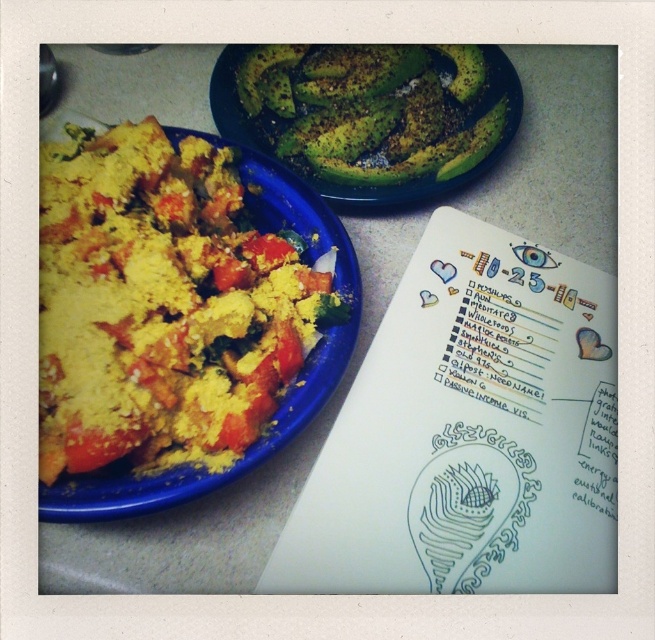
Question: Among these objects, which one is farthest from the camera?

Choices:
 (A) yellow crumbly at left
 (B) green matte avocado at upper center

Answer: (B)

Question: Among these objects, which one is farthest from the camera?

Choices:
 (A) green matte avocado at upper center
 (B) yellow crumbly at left

Answer: (A)

Question: Is yellow crumbly at left below green matte avocado at upper center?

Choices:
 (A) no
 (B) yes

Answer: (B)

Question: Does yellow crumbly at left appear on the right side of green matte avocado at upper center?

Choices:
 (A) no
 (B) yes

Answer: (A)

Question: Observing the image, what is the correct spatial positioning of yellow crumbly at left in reference to green matte avocado at upper center?

Choices:
 (A) right
 (B) left

Answer: (B)

Question: Which point is closer to the camera taking this photo?

Choices:
 (A) (362, 160)
 (B) (45, 272)

Answer: (B)